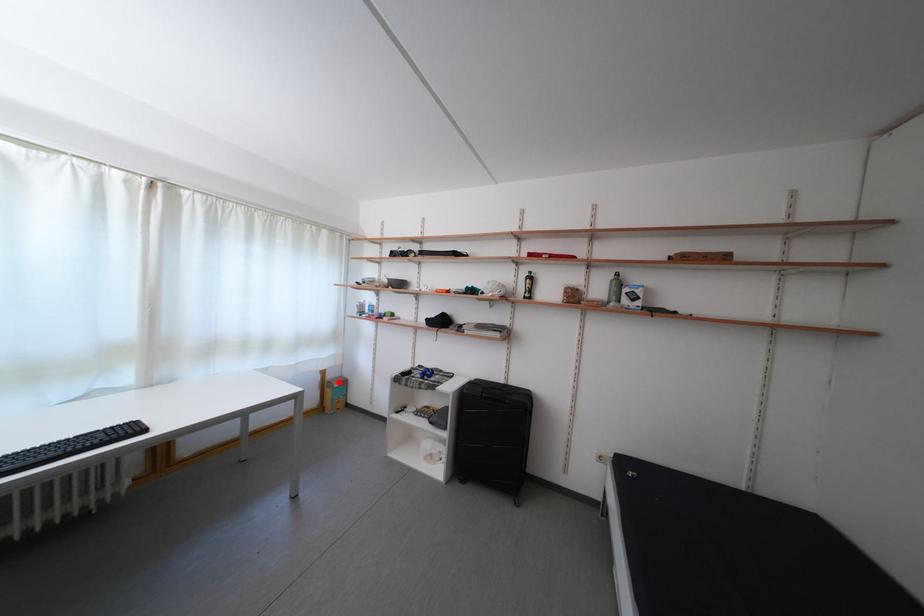
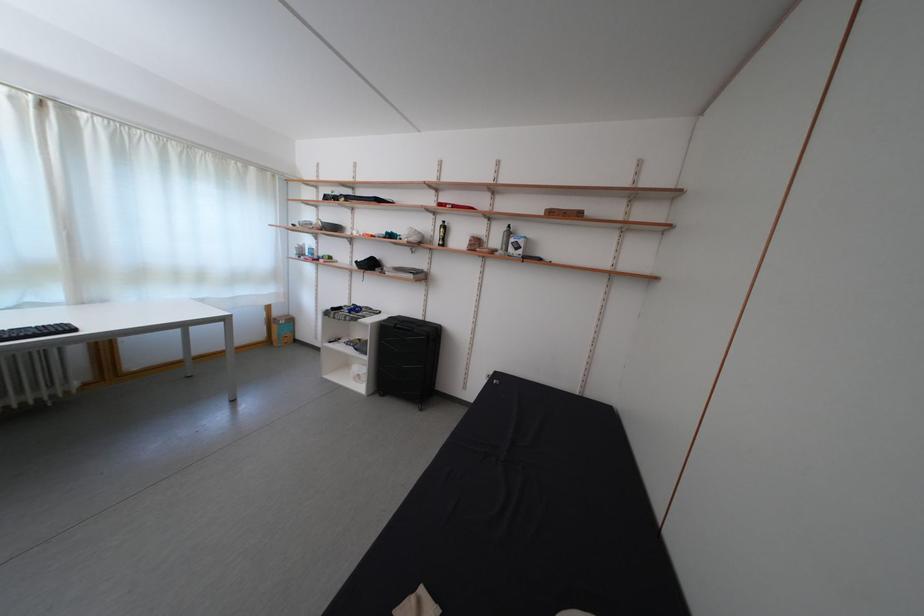
Question: I am providing you with two images of the same scene from different viewpoints. A red point is marked on the first image. Is the red point's position out of view in image 2?

Choices:
 (A) Yes
 (B) No

Answer: (B)